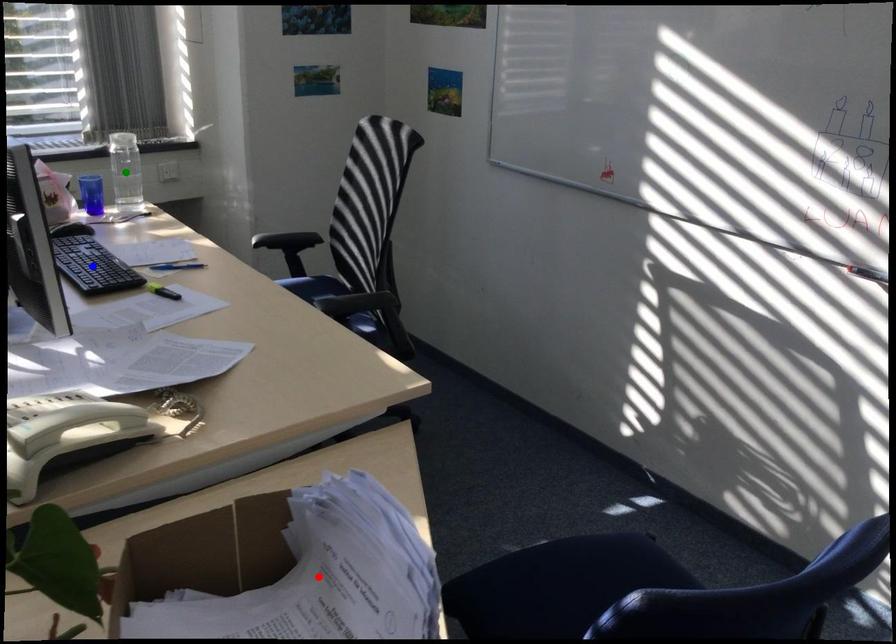
Order these from nearest to farthest:
blue point
red point
green point

green point
blue point
red point